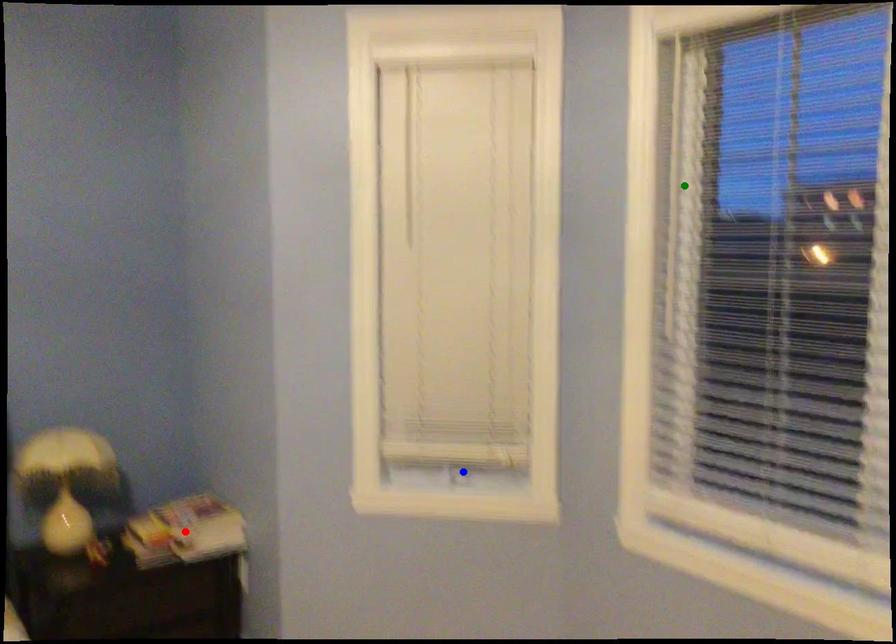
Order these from nearest to farthest:
A) red point
B) blue point
C) green point

green point < blue point < red point